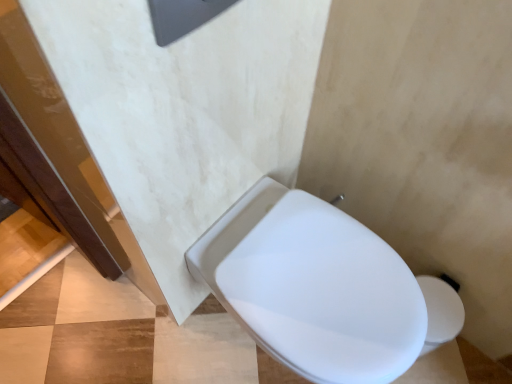
Locate an element on the screen. blank space situated above white glossy toilet at center (from a real-world perspective) is located at coordinates (321, 283).